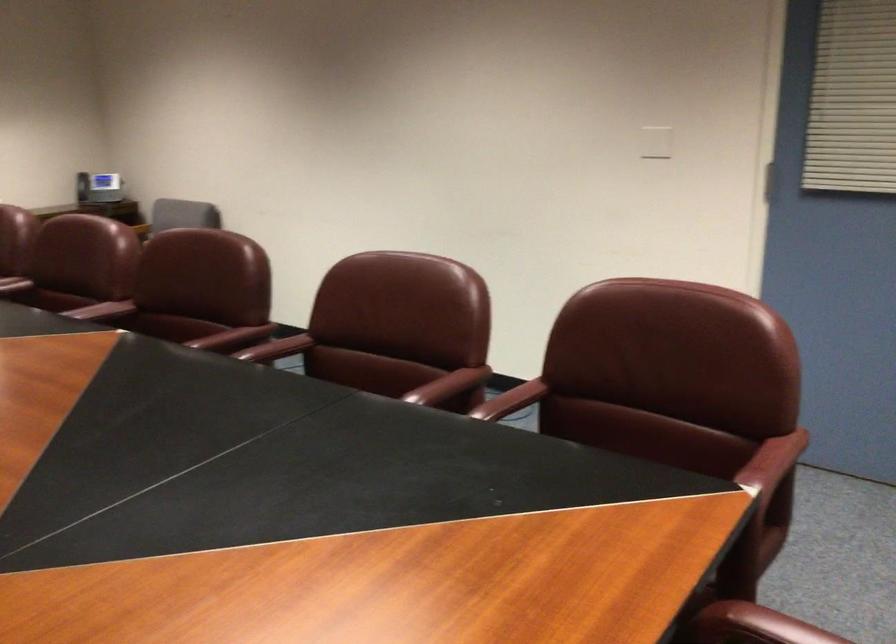
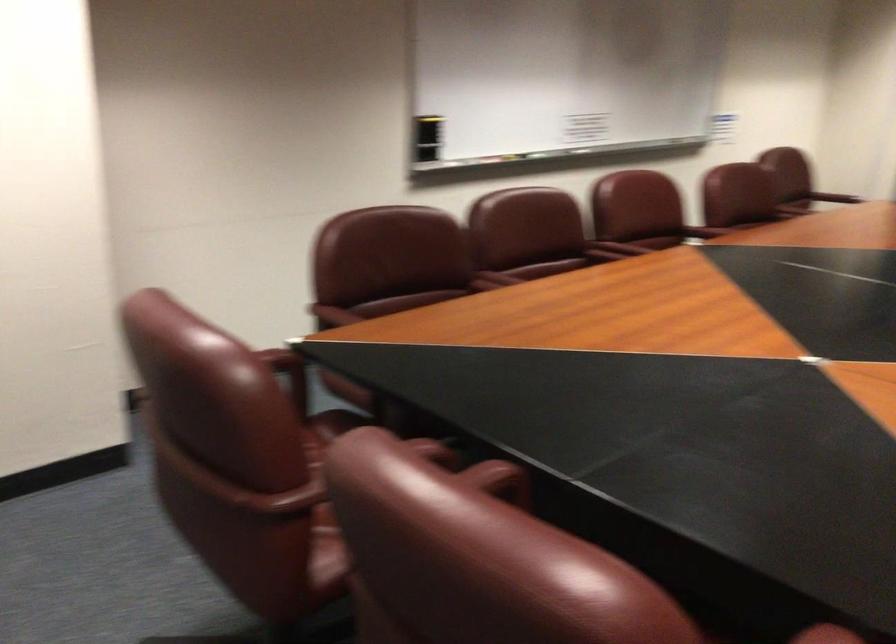
In the second image, find the point that corresponds to point 443,383 in the first image.

(495, 478)